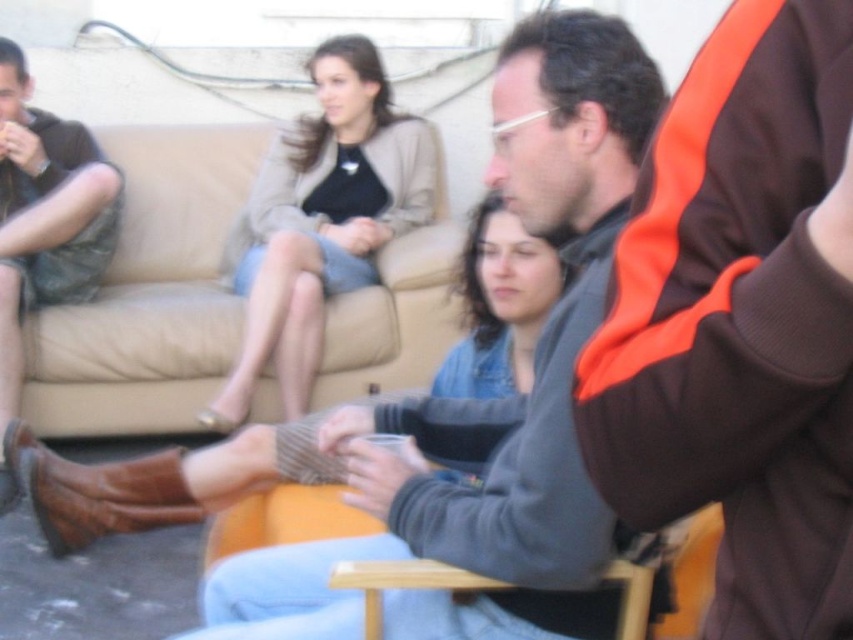
Which of these two, light beige fabric skirt at upper center or leather boots at left, stands shorter?

light beige fabric skirt at upper center

Which of these two, light beige fabric skirt at upper center or leather boots at left, stands taller?

leather boots at left is taller.

Which is in front, point (415, 211) or point (71, 224)?

Point (71, 224)

Locate an element on the screen. light beige fabric skirt at upper center is located at coordinates (321, 220).

Where is `beige fabric couch at upper center`? The width and height of the screenshot is (853, 640). beige fabric couch at upper center is located at coordinates (149, 291).

Is point (424, 266) less distant than point (28, 156)?

Yes.

Who is more forward, (x=202, y=220) or (x=15, y=406)?

Point (x=15, y=406) is more forward.

This screenshot has height=640, width=853. I want to click on beige fabric couch at upper center, so click(149, 291).

Can you confirm if brown fabric jacket at upper right is bigger than wooden chair at lower center?

Indeed, brown fabric jacket at upper right has a larger size compared to wooden chair at lower center.

Identify the location of brown fabric jacket at upper right. (740, 323).

The height and width of the screenshot is (640, 853). Describe the element at coordinates (740, 323) in the screenshot. I see `brown fabric jacket at upper right` at that location.

Identify the location of brown fabric jacket at upper right. (740, 323).